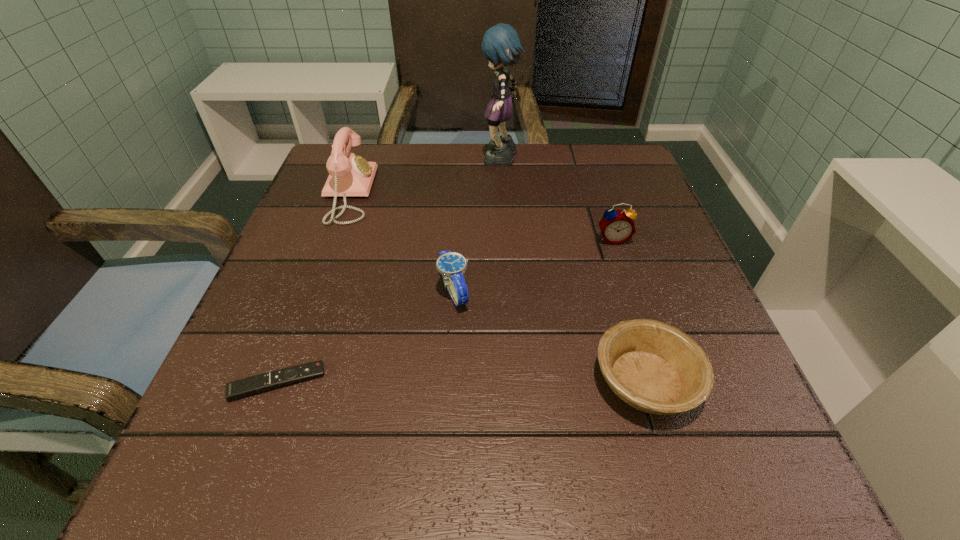
The image size is (960, 540). I want to click on free region located on the front-facing side of the tallest object, so click(x=358, y=161).

Identify the location of vacant space located 0.330m on the front-facing side of the tallest object. (346, 161).

Image resolution: width=960 pixels, height=540 pixels. Identify the location of blank space located 0.180m on the dial of the telephone. (453, 193).

This screenshot has width=960, height=540. I want to click on vacant space located on the front-facing side of the alarm clock, so click(631, 294).

I want to click on vacant space located on the left of the third nearest object, so click(282, 291).

Identify the location of vacant space located 0.400m on the left of the second shortest object. (319, 381).

Where is `free space located on the back of the remote control`? This screenshot has height=540, width=960. free space located on the back of the remote control is located at coordinates (305, 308).

Locate an element on the screen. Image resolution: width=960 pixels, height=540 pixels. rag doll situated at the far edge is located at coordinates point(501,45).

Locate an element on the screen. telephone present at the far edge is located at coordinates (349, 175).

The height and width of the screenshot is (540, 960). I want to click on telephone located in the left edge section of the desktop, so click(x=349, y=175).